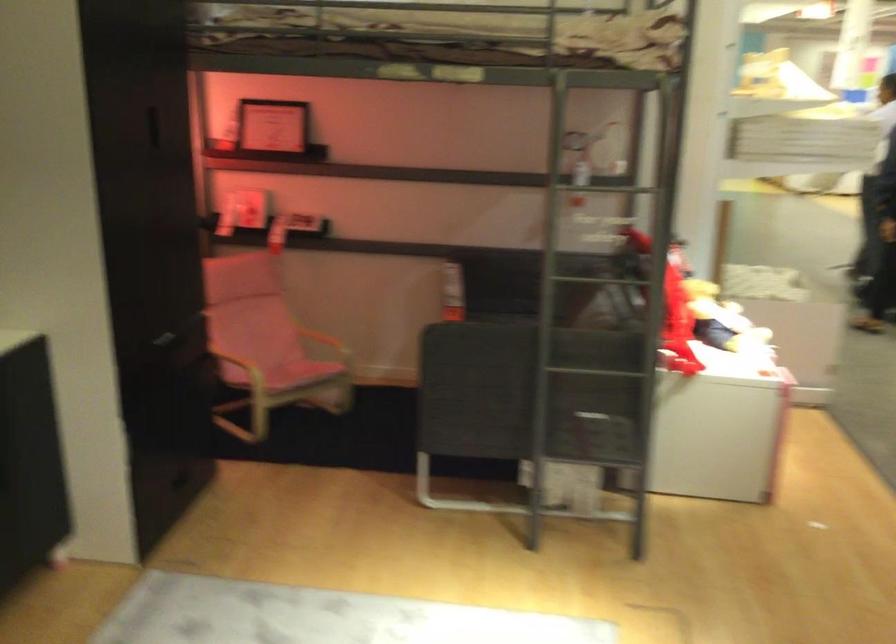
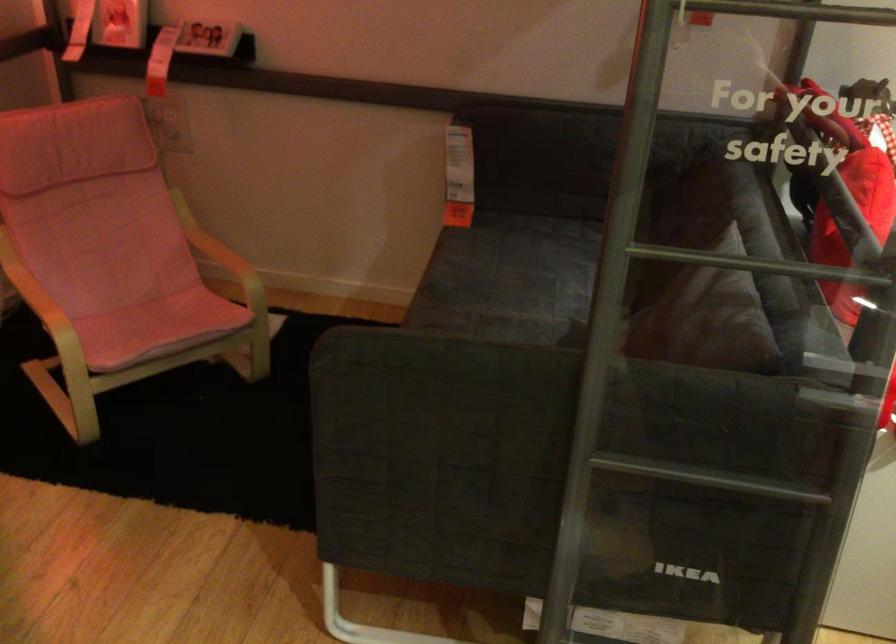
Where in the second image is the point corresponding to [330,335] from the first image?

(220, 252)